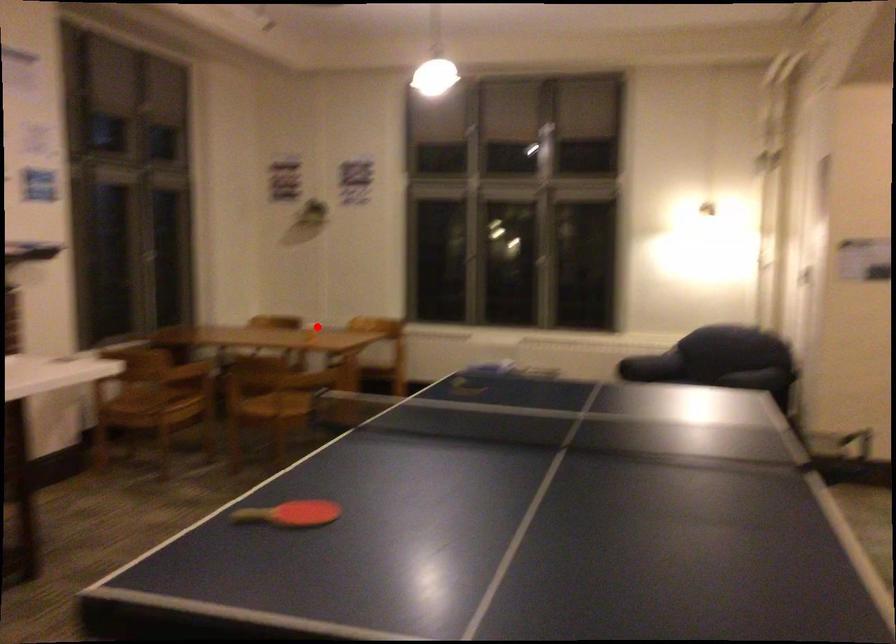
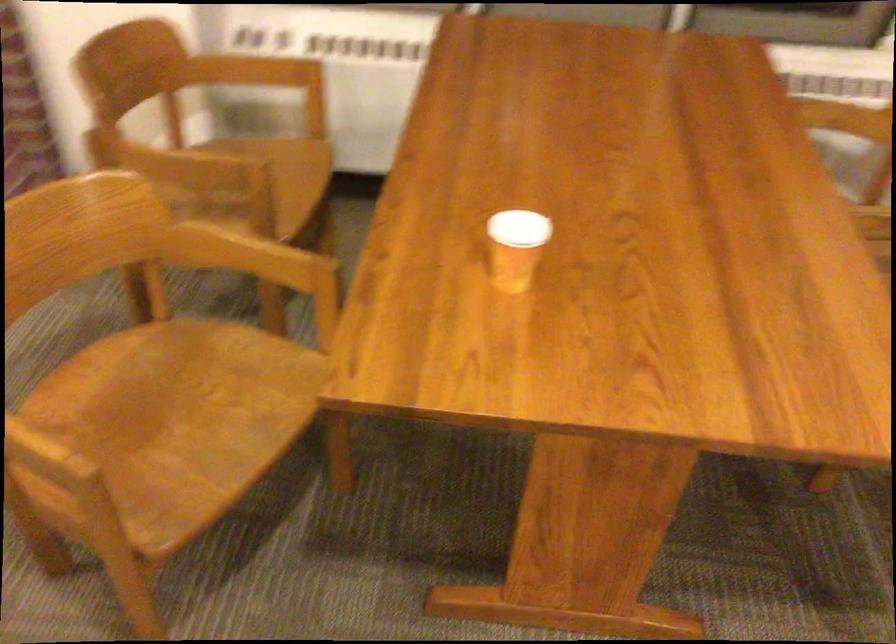
Question: I am providing you with two images of the same scene from different viewpoints. Given a red point in image1, look at the same physical point in image2. Is it:

Choices:
 (A) Closer to the viewpoint
 (B) Farther from the viewpoint

Answer: (A)